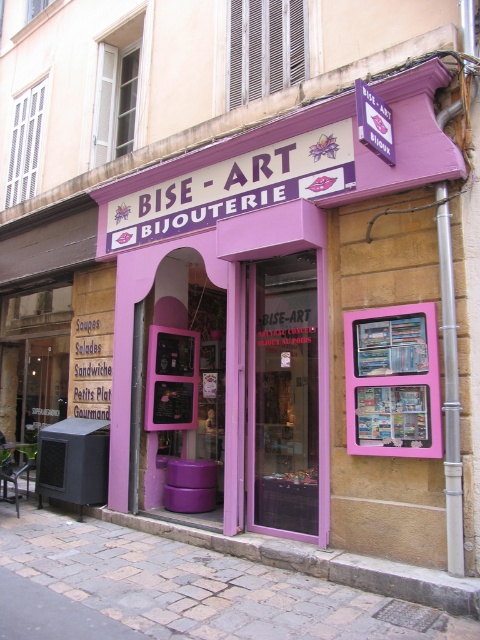
Between paved stone pavement at lower center and pink glossy bulletin board at center, which one has more height?

pink glossy bulletin board at center

Which is more to the left, paved stone pavement at lower center or pink glossy bulletin board at center?

paved stone pavement at lower center is more to the left.

Is point (78, 595) farther from viewer compared to point (410, 314)?

No, it is not.

Identify the location of paved stone pavement at lower center. (200, 586).